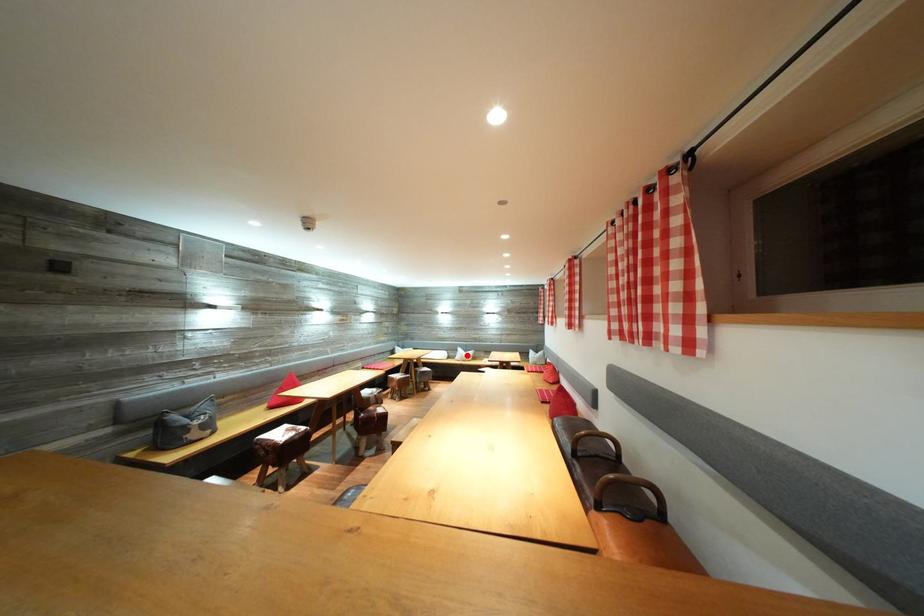
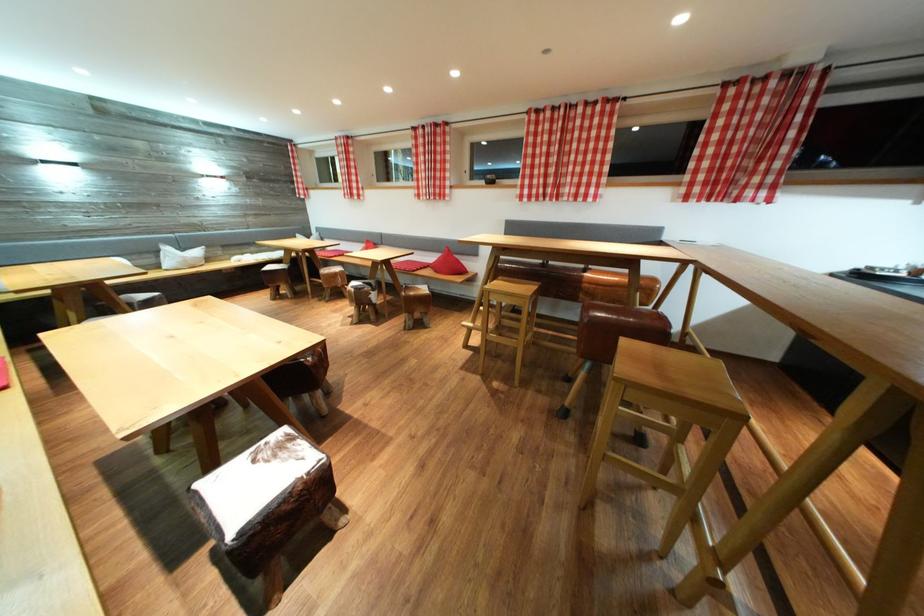
Question: I am providing you with two images of the same scene from different viewpoints. A red point is marked on the first image. Can you still see the location of the red point in image 2?

Choices:
 (A) Yes
 (B) No

Answer: (A)